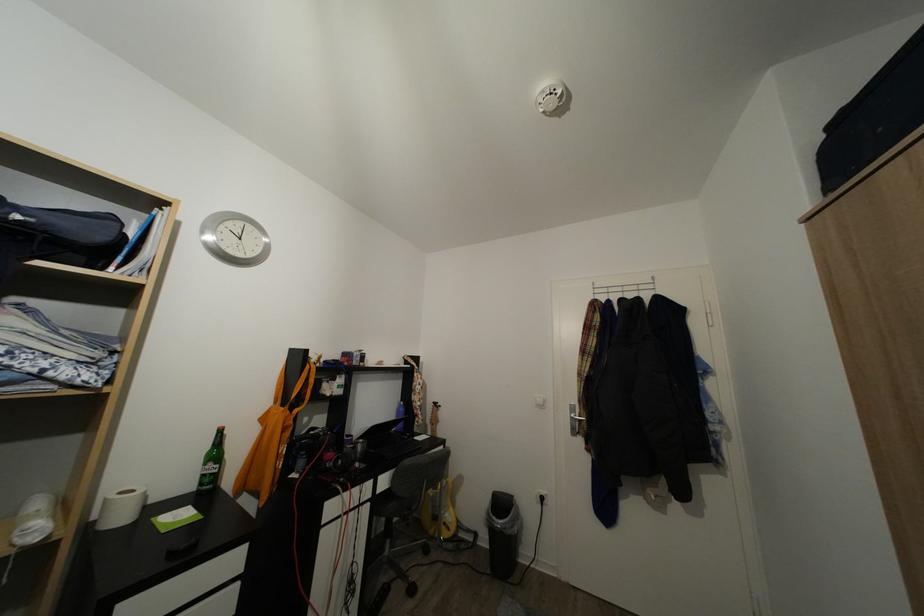
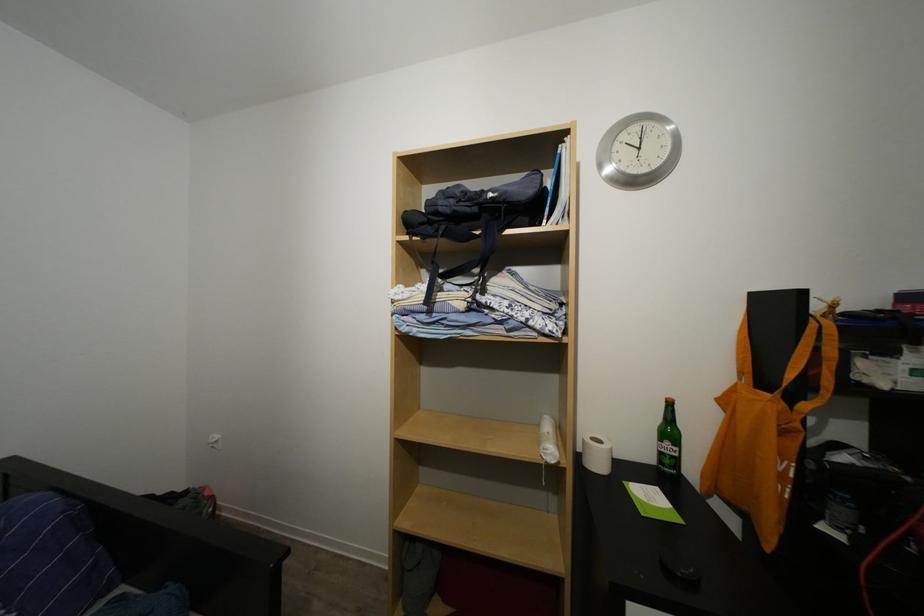
Question: The camera is either moving clockwise (left) or counter-clockwise (right) around the object. The first image is from the beginning of the video and the second image is from the end. Is the camera moving left or right when shooting the video?

Choices:
 (A) Left
 (B) Right

Answer: (B)